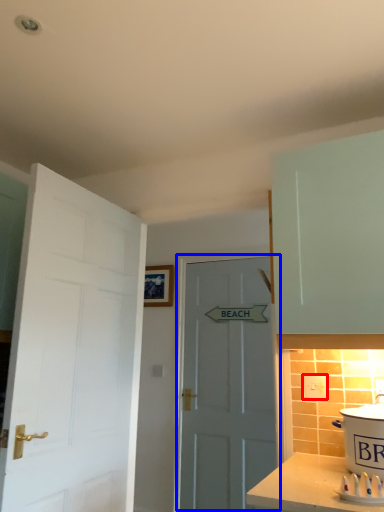
Question: Which point is further to the camera, electric outlet (highlighted by a red box) or door (highlighted by a blue box)?

Choices:
 (A) electric outlet
 (B) door

Answer: (B)